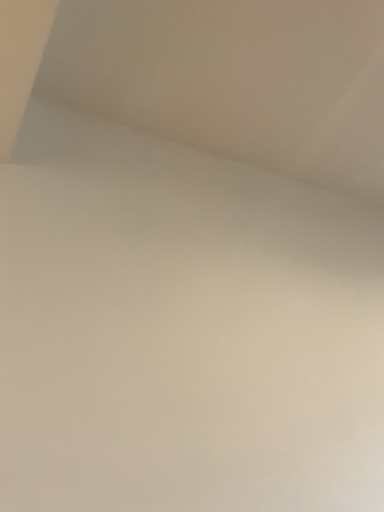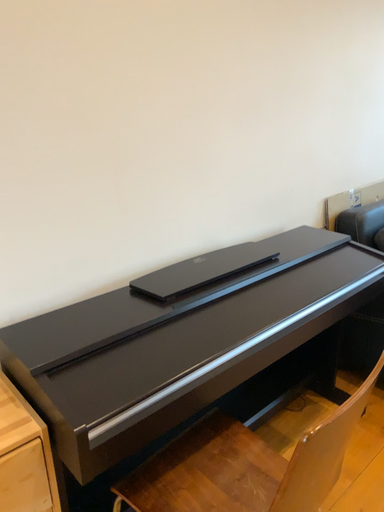
Question: Which way did the camera rotate in the video?

Choices:
 (A) rotated left
 (B) rotated right

Answer: (B)